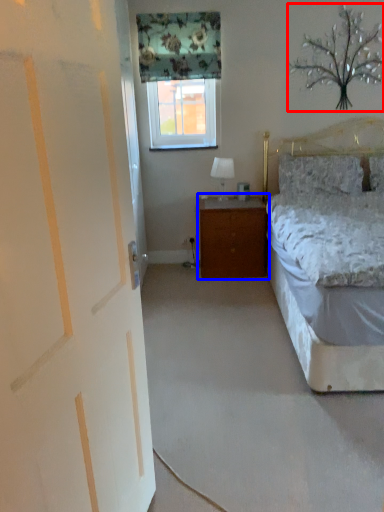
Question: Which point is closer to the camera, tree (highlighted by a red box) or nightstand (highlighted by a blue box)?

Choices:
 (A) tree
 (B) nightstand

Answer: (A)